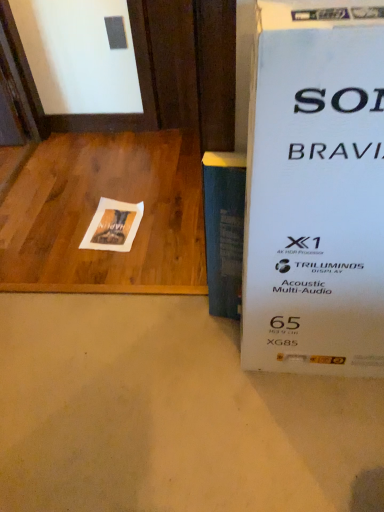
Question: Is white paper at center further to the viewer compared to blue matte book at center?

Choices:
 (A) no
 (B) yes

Answer: (B)

Question: Is blue matte book at center a part of white paper at center?

Choices:
 (A) yes
 (B) no

Answer: (B)

Question: Is white paper at center positioned before blue matte book at center?

Choices:
 (A) no
 (B) yes

Answer: (A)

Question: Is white paper at center aimed at blue matte book at center?

Choices:
 (A) yes
 (B) no

Answer: (B)

Question: Is white paper at center beside blue matte book at center?

Choices:
 (A) yes
 (B) no

Answer: (B)

Question: From the image's perspective, would you say white paper at center is positioned over blue matte book at center?

Choices:
 (A) yes
 (B) no

Answer: (A)

Question: Is wooden at left to the left of white paper at center from the viewer's perspective?

Choices:
 (A) no
 (B) yes

Answer: (B)

Question: Can you confirm if wooden at left is bigger than white paper at center?

Choices:
 (A) no
 (B) yes

Answer: (B)

Question: Can you confirm if wooden at left is smaller than white paper at center?

Choices:
 (A) yes
 (B) no

Answer: (B)

Question: Considering the relative positions of wooden at left and white paper at center in the image provided, is wooden at left to the right of white paper at center from the viewer's perspective?

Choices:
 (A) yes
 (B) no

Answer: (B)

Question: Is wooden at left aimed at white paper at center?

Choices:
 (A) yes
 (B) no

Answer: (A)

Question: Can you confirm if wooden at left is thinner than white paper at center?

Choices:
 (A) no
 (B) yes

Answer: (A)

Question: From a real-world perspective, is wooden at left located higher than blue matte book at center?

Choices:
 (A) no
 (B) yes

Answer: (A)